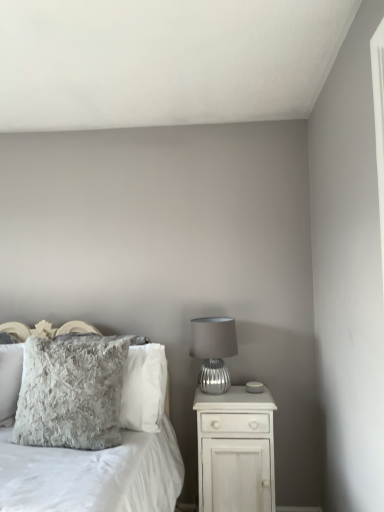
Question: Is white wood nightstand at right not within silver textured lamp at right?

Choices:
 (A) yes
 (B) no

Answer: (A)

Question: Does white wood nightstand at right touch silver textured lamp at right?

Choices:
 (A) no
 (B) yes

Answer: (A)

Question: Is white wood nightstand at right looking in the opposite direction of silver textured lamp at right?

Choices:
 (A) no
 (B) yes

Answer: (A)

Question: Is white wood nightstand at right positioned in front of silver textured lamp at right?

Choices:
 (A) yes
 (B) no

Answer: (A)

Question: Would you consider white wood nightstand at right to be distant from silver textured lamp at right?

Choices:
 (A) no
 (B) yes

Answer: (A)

Question: Do you think white wood nightstand at right is within fuzzy gray pillow at center-left, the first pillow from the back, or outside of it?

Choices:
 (A) outside
 (B) inside

Answer: (A)

Question: From the image's perspective, is white wood nightstand at right positioned above or below fuzzy gray pillow at center-left, the first pillow from the back?

Choices:
 (A) above
 (B) below

Answer: (B)

Question: In terms of size, does white wood nightstand at right appear bigger or smaller than fuzzy gray pillow at center-left, the first pillow from the back?

Choices:
 (A) big
 (B) small

Answer: (A)

Question: Considering the positions of white wood nightstand at right and fuzzy gray pillow at center-left, positioned as the 2th pillow in front-to-back order, in the image, is white wood nightstand at right wider or thinner than fuzzy gray pillow at center-left, positioned as the 2th pillow in front-to-back order,?

Choices:
 (A) wide
 (B) thin

Answer: (A)

Question: Is fuzzy gray pillow at center inside or outside of fuzzy gray pillow at left, which is counted as the 1th pillow, starting from the front?

Choices:
 (A) outside
 (B) inside

Answer: (A)

Question: Considering the positions of fuzzy gray pillow at center and fuzzy gray pillow at left, which is counted as the 1th pillow, starting from the front, in the image, is fuzzy gray pillow at center wider or thinner than fuzzy gray pillow at left, which is counted as the 1th pillow, starting from the front,?

Choices:
 (A) thin
 (B) wide

Answer: (B)

Question: In terms of size, does fuzzy gray pillow at center appear bigger or smaller than fuzzy gray pillow at left, which is counted as the 1th pillow, starting from the front?

Choices:
 (A) big
 (B) small

Answer: (A)

Question: From a real-world perspective, is fuzzy gray pillow at center physically located above or below fuzzy gray pillow at left, the 2th pillow positioned from the back?

Choices:
 (A) below
 (B) above

Answer: (A)

Question: Is white wood nightstand at right in front of or behind fuzzy gray pillow at left, the 2th pillow positioned from the back, in the image?

Choices:
 (A) behind
 (B) front

Answer: (A)

Question: Is white wood nightstand at right wider or thinner than fuzzy gray pillow at left, the 2th pillow positioned from the back?

Choices:
 (A) wide
 (B) thin

Answer: (A)